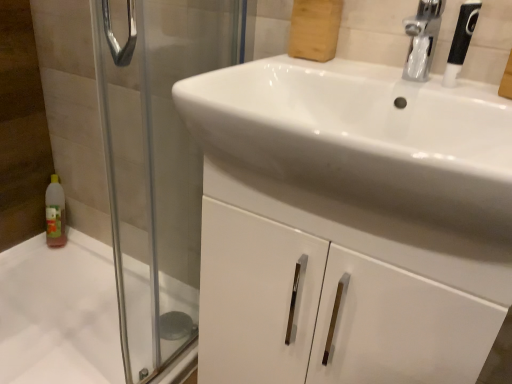
Question: Is black textured shower head at upper right not within transparent glass screen door at left?

Choices:
 (A) no
 (B) yes

Answer: (B)

Question: Does black textured shower head at upper right contain transparent glass screen door at left?

Choices:
 (A) no
 (B) yes

Answer: (A)

Question: Considering the relative sizes of black textured shower head at upper right and transparent glass screen door at left in the image provided, is black textured shower head at upper right taller than transparent glass screen door at left?

Choices:
 (A) no
 (B) yes

Answer: (A)

Question: From a real-world perspective, is black textured shower head at upper right beneath transparent glass screen door at left?

Choices:
 (A) no
 (B) yes

Answer: (A)

Question: Does black textured shower head at upper right lie in front of transparent glass screen door at left?

Choices:
 (A) yes
 (B) no

Answer: (B)

Question: In the image, is white glossy sink at center positioned in front of or behind transparent glass screen door at left?

Choices:
 (A) behind
 (B) front

Answer: (B)

Question: Is white glossy sink at center inside or outside of transparent glass screen door at left?

Choices:
 (A) inside
 (B) outside

Answer: (B)

Question: From a real-world perspective, is white glossy sink at center physically located above or below transparent glass screen door at left?

Choices:
 (A) above
 (B) below

Answer: (A)

Question: Looking at the image, does white glossy sink at center seem bigger or smaller compared to transparent glass screen door at left?

Choices:
 (A) small
 (B) big

Answer: (B)

Question: From a real-world perspective, is transparent glass screen door at left positioned above or below black textured shower head at upper right?

Choices:
 (A) above
 (B) below

Answer: (B)

Question: Considering the relative positions of transparent glass screen door at left and black textured shower head at upper right in the image provided, is transparent glass screen door at left to the left or to the right of black textured shower head at upper right?

Choices:
 (A) right
 (B) left

Answer: (B)

Question: From the image's perspective, relative to black textured shower head at upper right, is transparent glass screen door at left above or below?

Choices:
 (A) below
 (B) above

Answer: (A)

Question: Looking at their shapes, would you say transparent glass screen door at left is wider or thinner than black textured shower head at upper right?

Choices:
 (A) thin
 (B) wide

Answer: (B)

Question: Is black textured shower head at upper right taller or shorter than white glossy cabinet at center?

Choices:
 (A) short
 (B) tall

Answer: (A)

Question: Based on their positions, is black textured shower head at upper right located to the left or right of white glossy cabinet at center?

Choices:
 (A) right
 (B) left

Answer: (A)